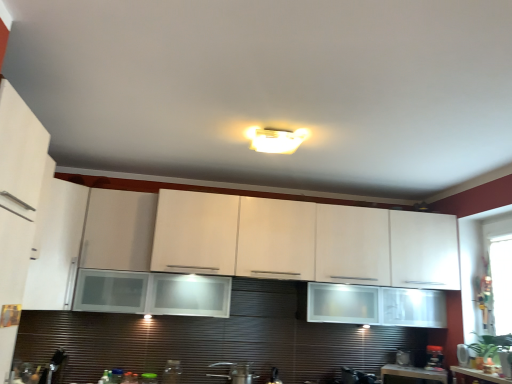
Question: Would you say white glossy countertop at lower right is to the left or to the right of transparent glass window screen at right in the picture?

Choices:
 (A) left
 (B) right

Answer: (A)

Question: Is white glossy countertop at lower right inside or outside of transparent glass window screen at right?

Choices:
 (A) inside
 (B) outside

Answer: (B)

Question: Which of these objects is positioned closest to the black plastic coffee maker at lower right, the second appliance when ordered from right to left?

Choices:
 (A) white glossy microwave at upper right, which is the 7th appliance from left to right
 (B) metallic silver toaster at lower center, which is the sixth appliance from right to left
 (C) white glossy countertop at lower right
 (D) metallic silver toaster at lower right, which is the 3th appliance in right-to-left order
 (E) white glossy countertop at lower right

Answer: (D)

Question: Estimate the real-world distances between objects in this image. Which object is farther from the white glossy countertop at lower right?

Choices:
 (A) white glossy microwave at upper right, which is the 7th appliance from left to right
 (B) satin silver faucet at center, which appears as the third appliance when viewed from the left
 (C) metallic silver toaster at lower right, which is the 3th appliance in right-to-left order
 (D) black glossy coffee maker at lower center, acting as the 4th appliance starting from the right
 (E) white glossy countertop at lower right

Answer: (B)